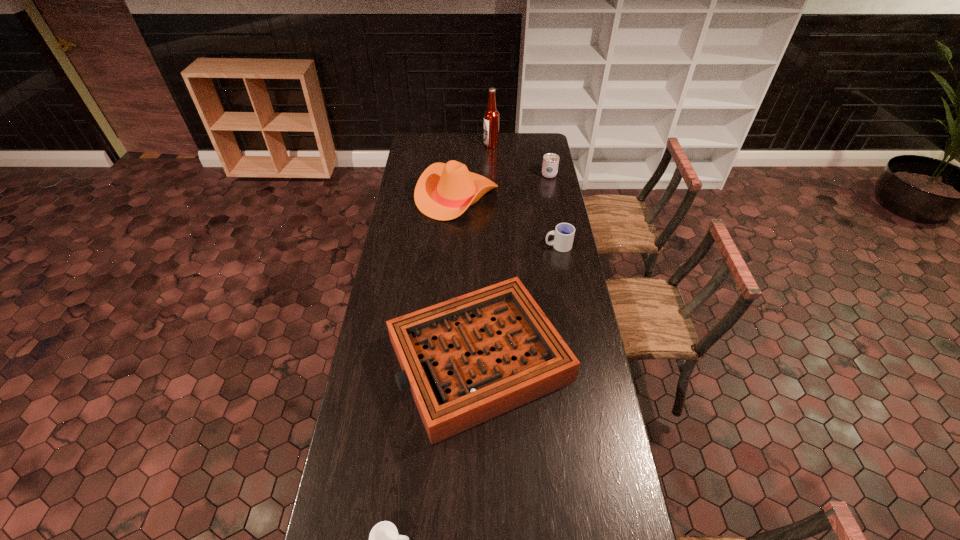
The image size is (960, 540). In order to click on cowboy hat that is at the left edge in this screenshot , I will do `click(443, 192)`.

You are a GUI agent. You are given a task and a screenshot of the screen. Output one action in this format:
    pyautogui.click(x=<x>, y=<y>)
    Task: Click on the gameboard that is at the left edge
    
    Given the screenshot: What is the action you would take?
    pyautogui.click(x=466, y=360)

Find the location of a particular element. The image size is (960, 540). gameboard that is at the right edge is located at coordinates (466, 360).

I want to click on vacant area at the far edge of the desktop, so click(x=510, y=136).

At what (x,y) coordinates should I click in order to perform the action: click on free space at the left edge of the desktop. Please return your answer as a coordinate pair (x, y). Looking at the image, I should click on (398, 415).

Locate an element on the screen. This screenshot has width=960, height=540. free space at the right edge of the desktop is located at coordinates (601, 444).

Where is `vacant area between the tallest object and the second shortest cup`? This screenshot has width=960, height=540. vacant area between the tallest object and the second shortest cup is located at coordinates (524, 195).

Image resolution: width=960 pixels, height=540 pixels. Identify the location of unoccupied area between the third tallest object and the farthest object. (520, 159).

Find the location of a particular element. The width and height of the screenshot is (960, 540). empty space between the fourth shortest object and the second tallest object is located at coordinates (503, 185).

The height and width of the screenshot is (540, 960). I want to click on unoccupied area between the fourth farthest object and the alcohol, so click(524, 195).